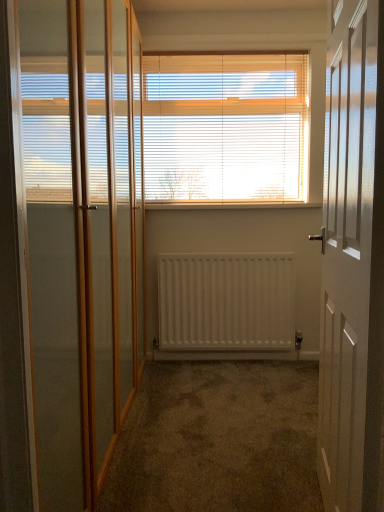
Where is `vacant region above white matte radiator at center (from a real-world perspective)`? Image resolution: width=384 pixels, height=512 pixels. vacant region above white matte radiator at center (from a real-world perspective) is located at coordinates (208, 250).